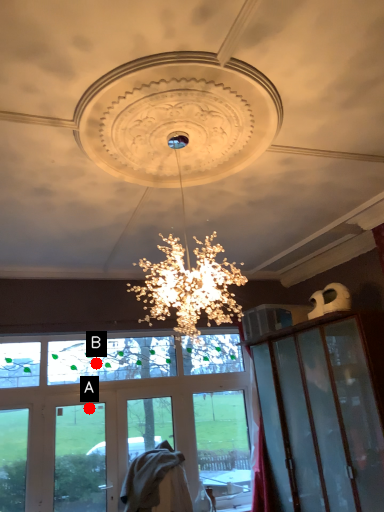
Question: Two points are circled on the image, labeled by A and B beside each circle. Which point is closer to the camera taking this photo?

Choices:
 (A) A is closer
 (B) B is closer

Answer: (A)